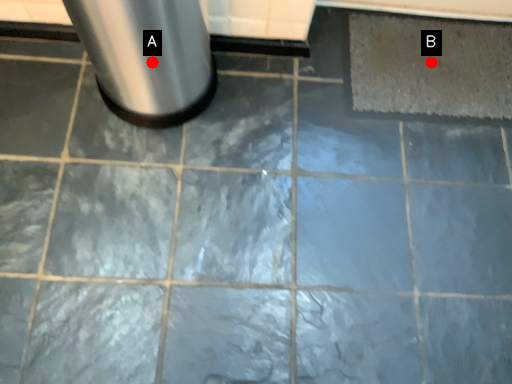
Question: Two points are circled on the image, labeled by A and B beside each circle. Which point appears closest to the camera in this image?

Choices:
 (A) A is closer
 (B) B is closer

Answer: (A)